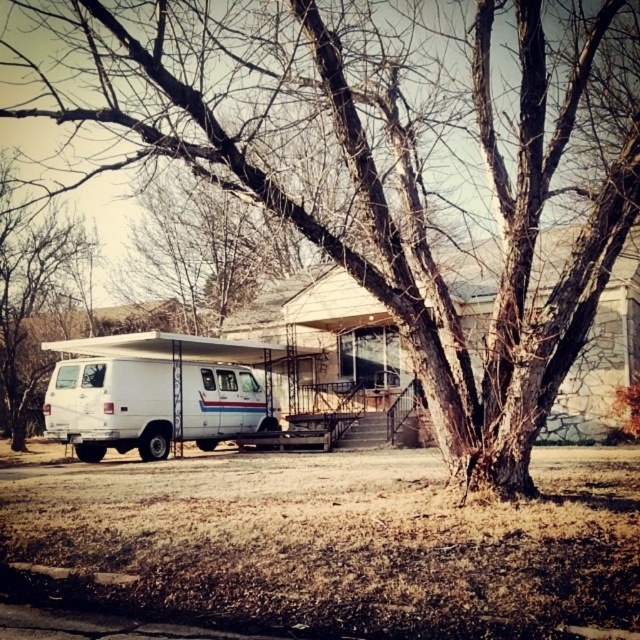
Consider the image. Can you confirm if white matte van at lower left is smaller than bare wood tree at left?

Yes.

Between white matte van at lower left and bare wood tree at left, which one has more height?

Standing taller between the two is bare wood tree at left.

Between point (241, 413) and point (48, 292), which one is positioned in front?

Positioned in front is point (241, 413).

At what (x,y) coordinates should I click in order to perform the action: click on white matte van at lower left. Please return your answer as a coordinate pair (x, y). Image resolution: width=640 pixels, height=640 pixels. Looking at the image, I should click on (109, 404).